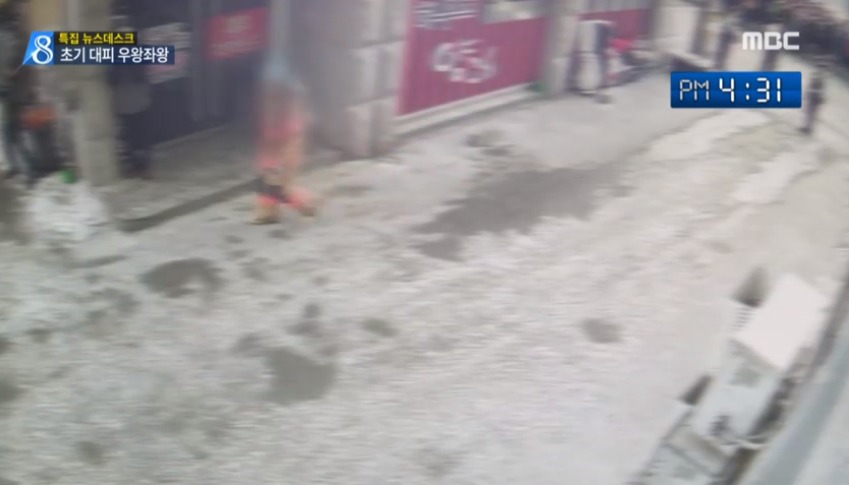
Identify the location of red wall. The width and height of the screenshot is (849, 485). click(x=429, y=72).